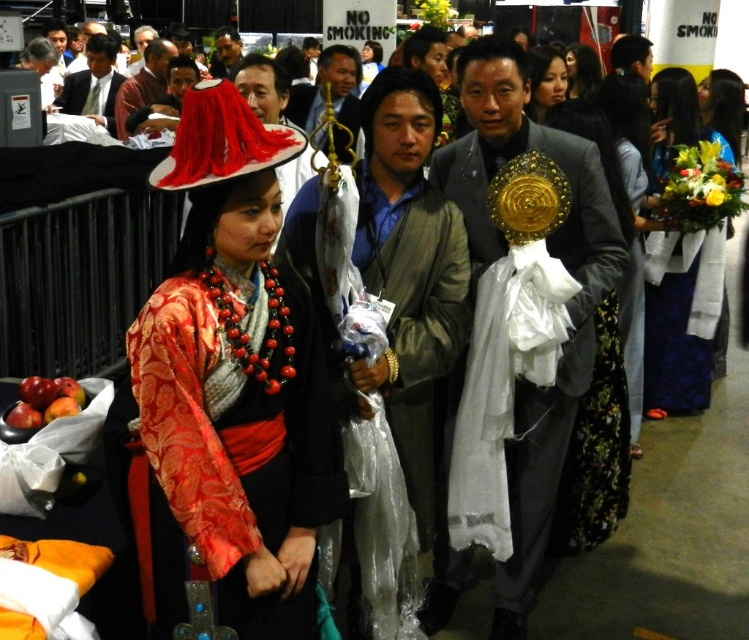
Who is shorter, matte gray suit at center or shiny gold medallion at center?

Standing shorter between the two is matte gray suit at center.

What do you see at coordinates (398, 342) in the screenshot?
I see `matte gray suit at center` at bounding box center [398, 342].

Find the location of a particular element. matte gray suit at center is located at coordinates (398, 342).

Can you confirm if matte gray suit at center is positioned to the left of shiny red apples at lower left?

No, matte gray suit at center is not to the left of shiny red apples at lower left.

Where is `matte gray suit at center`? matte gray suit at center is located at coordinates (398, 342).

Find the location of a particular element. Image resolution: width=749 pixels, height=640 pixels. matte gray suit at center is located at coordinates (398, 342).

Between shiny gold medallion at center and matte black dress at center, which one is positioned lower?

shiny gold medallion at center is lower down.

Is point (570, 237) positioned behind point (554, 52)?

No, it is not.

Who is more forward, (551, 467) or (557, 65)?

Positioned in front is point (551, 467).

You are a GUI agent. You are given a task and a screenshot of the screen. Output one action in this format:
    pyautogui.click(x=<x>, y=<y>)
    Task: Click on the shiny gold medallion at center
    
    Given the screenshot: What is the action you would take?
    pyautogui.click(x=565, y=305)